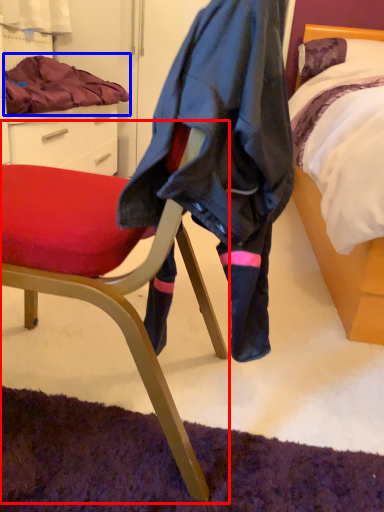
Question: Which object appears farthest to the camera in this image, chair (highlighted by a red box) or blanket (highlighted by a blue box)?

Choices:
 (A) chair
 (B) blanket

Answer: (B)